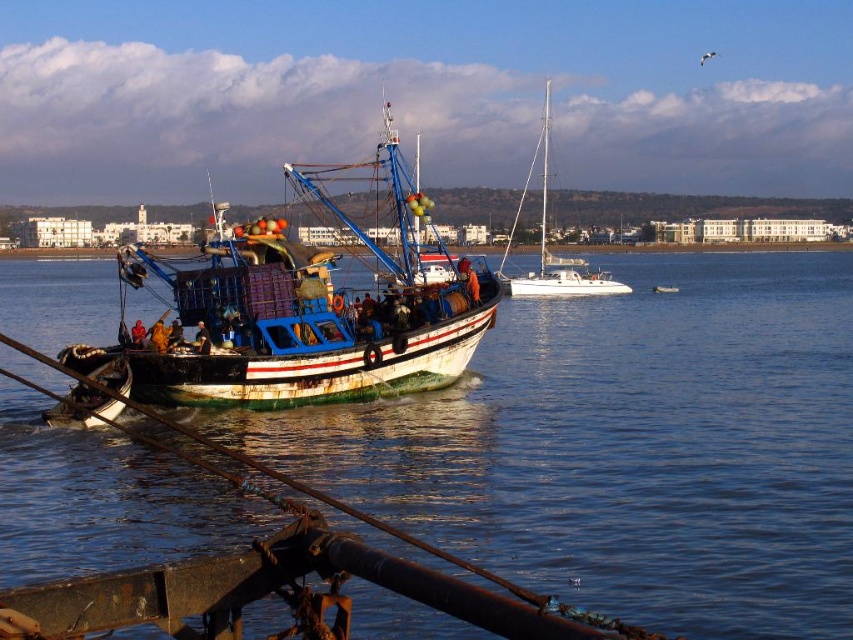
Describe the element at coordinates (625, 448) in the screenshot. The image size is (853, 640). I see `blue water at center` at that location.

Which of these two, blue water at center or rusty metal boat at center, stands taller?

rusty metal boat at center is taller.

Describe the element at coordinates (625, 448) in the screenshot. Image resolution: width=853 pixels, height=640 pixels. I see `blue water at center` at that location.

Where is `blue water at center`? Image resolution: width=853 pixels, height=640 pixels. blue water at center is located at coordinates (625, 448).

Can you confirm if blue water at center is thinner than white glossy sailboat at center?

In fact, blue water at center might be wider than white glossy sailboat at center.

Is blue water at center to the left of white glossy sailboat at center from the viewer's perspective?

Indeed, blue water at center is positioned on the left side of white glossy sailboat at center.

Is point (19, 442) behind point (581, 292)?

No, (19, 442) is closer to viewer.

Where is `blue water at center`? The width and height of the screenshot is (853, 640). blue water at center is located at coordinates pyautogui.click(x=625, y=448).

Is point (334, 388) farther from viewer compared to point (503, 266)?

No, (334, 388) is closer to viewer.

Does rusty metal boat at center appear on the left side of white glossy sailboat at center?

Correct, you'll find rusty metal boat at center to the left of white glossy sailboat at center.

Locate an element on the screen. The height and width of the screenshot is (640, 853). rusty metal boat at center is located at coordinates coord(305,314).